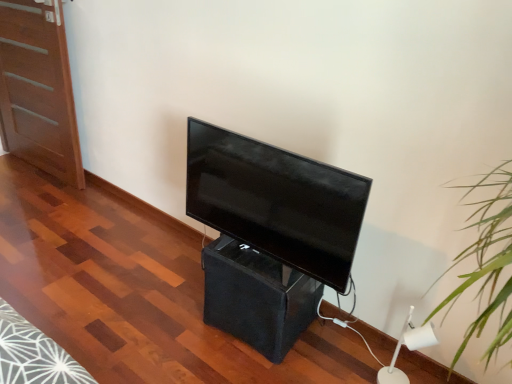
Find the location of a particular element. vacant area that lies between black fabric speaker at center and matte wood door at left is located at coordinates (121, 227).